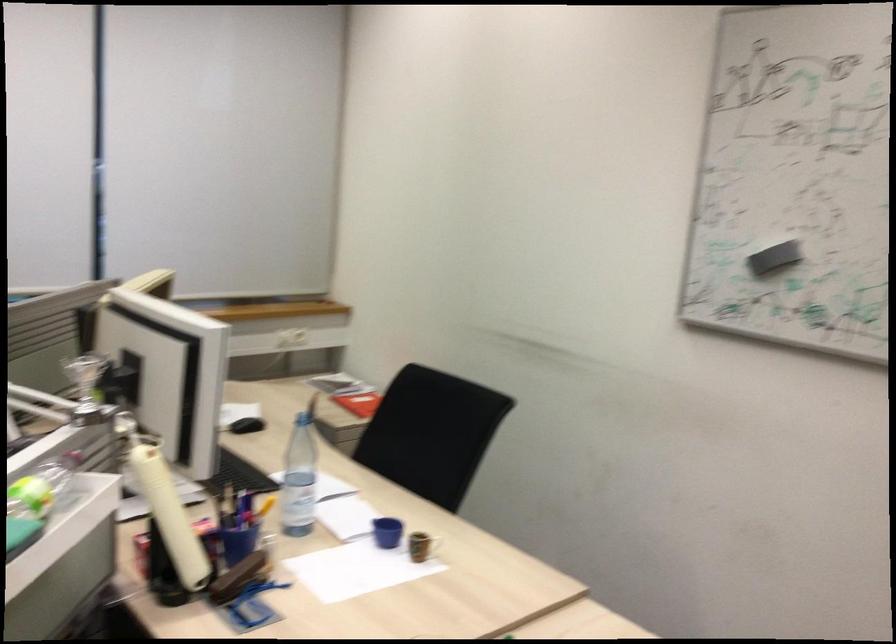
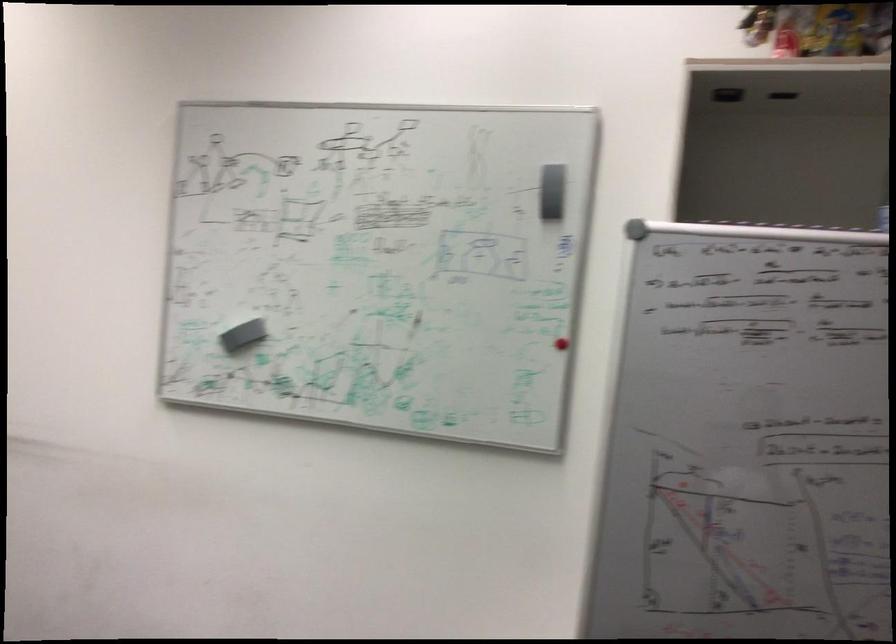
Question: The camera is either moving clockwise (left) or counter-clockwise (right) around the object. The first image is from the beginning of the video and the second image is from the end. Is the camera moving left or right when shooting the video?

Choices:
 (A) Left
 (B) Right

Answer: (A)